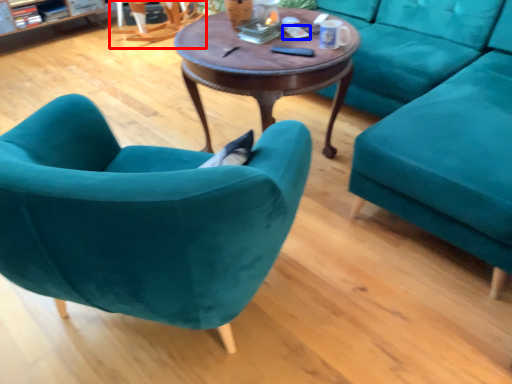
Question: Which point is further to the camera, armchair (highlighted by a red box) or remote control (highlighted by a blue box)?

Choices:
 (A) armchair
 (B) remote control

Answer: (A)